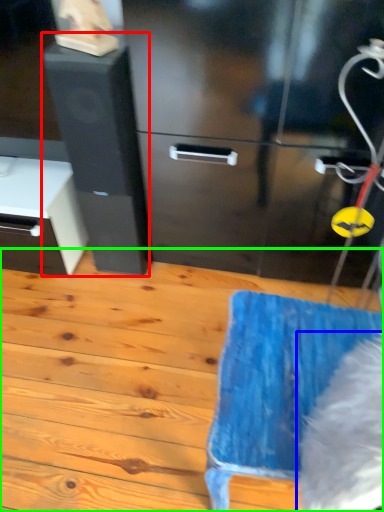
Question: Which is nearer to the file cabinet (highlighted by a red box)? animal (highlighted by a blue box) or wood (highlighted by a green box).

Choices:
 (A) animal
 (B) wood

Answer: (B)